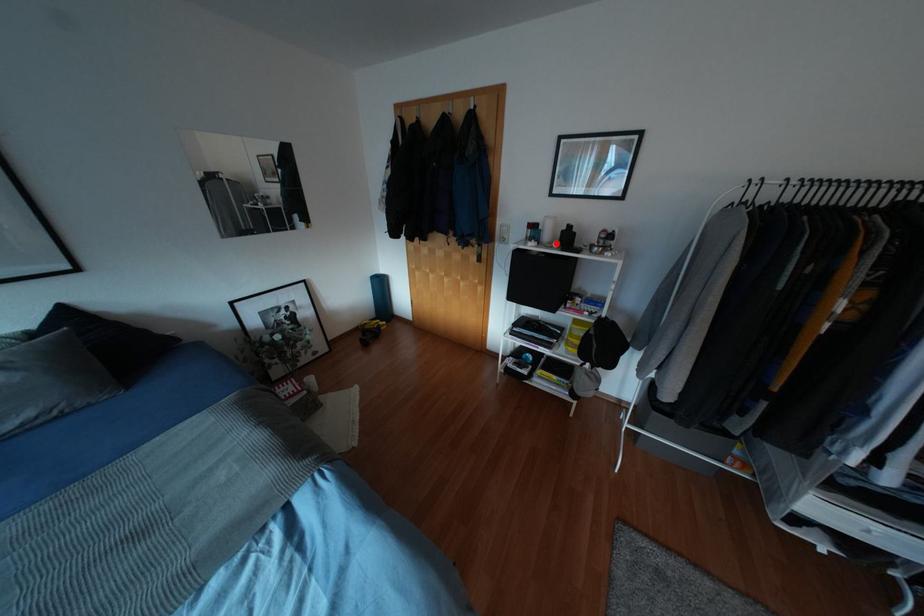
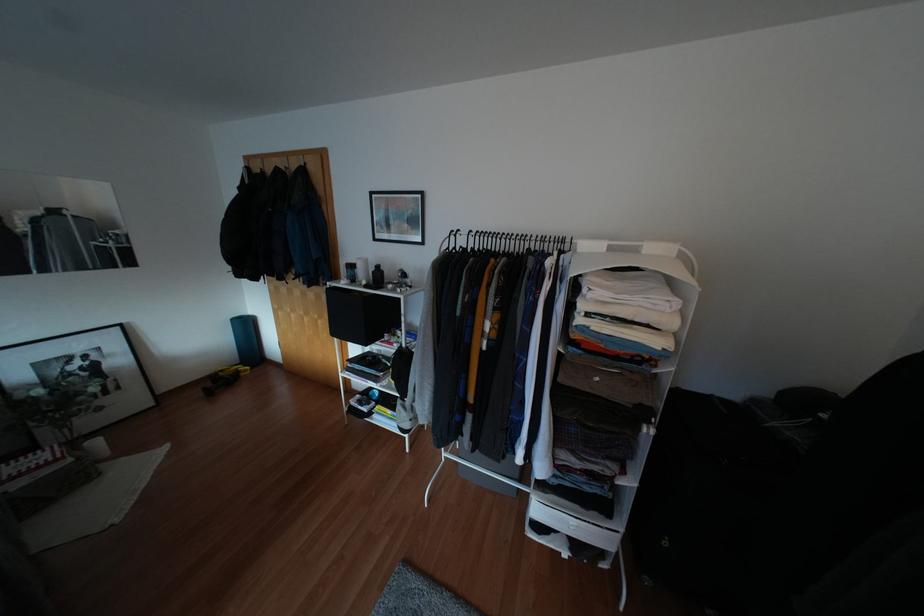
Question: I am providing you with two images of the same scene from different viewpoints. Image1 has a red point marked. In image2, the corresponding 3D location appears at what relative position? Reply with the corresponding letter.

Choices:
 (A) Closer
 (B) Farther

Answer: (B)